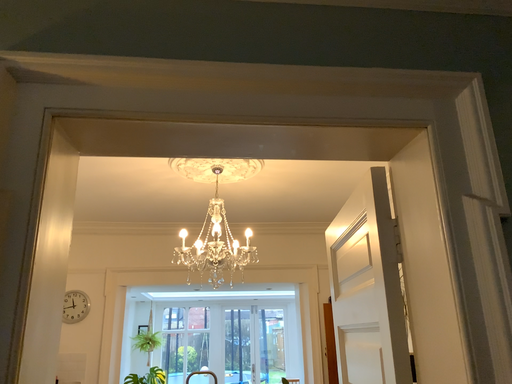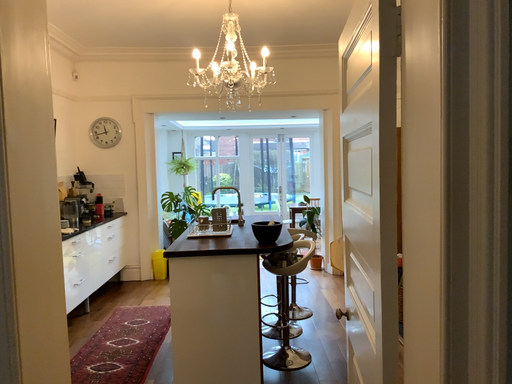
Question: How did the camera likely rotate when shooting the video?

Choices:
 (A) rotated upward
 (B) rotated downward

Answer: (B)